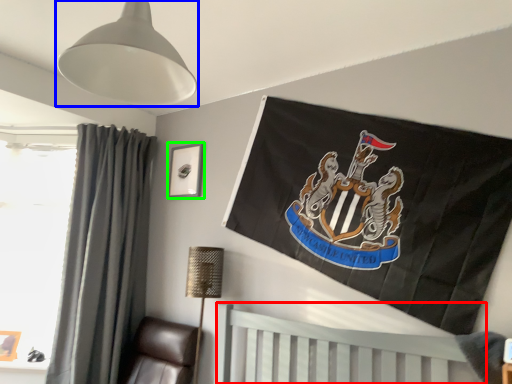
Question: Based on their relative distances, which object is farther from furniture (highlighted by a red box)? Choose from lamp (highlighted by a blue box) and picture frame (highlighted by a green box).

Choices:
 (A) lamp
 (B) picture frame

Answer: (A)